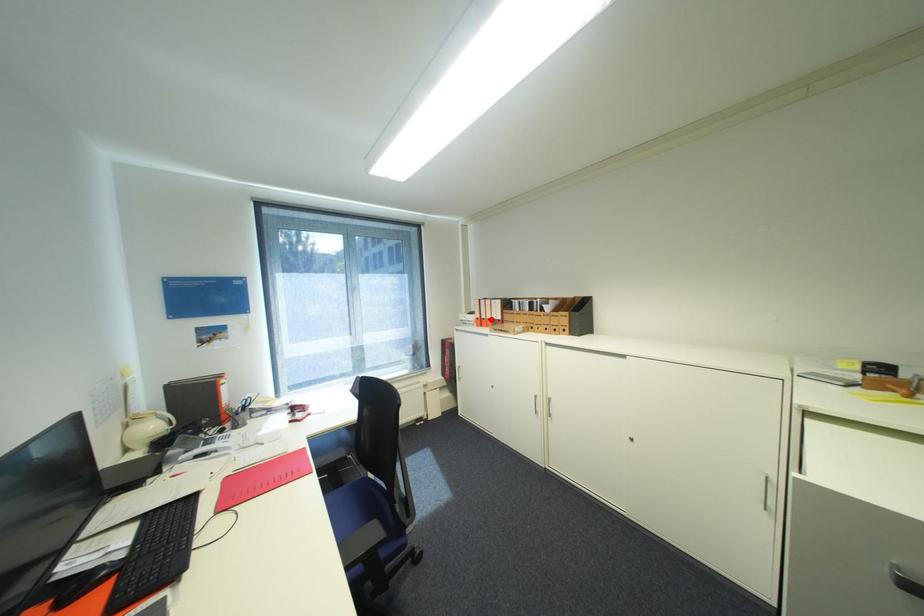
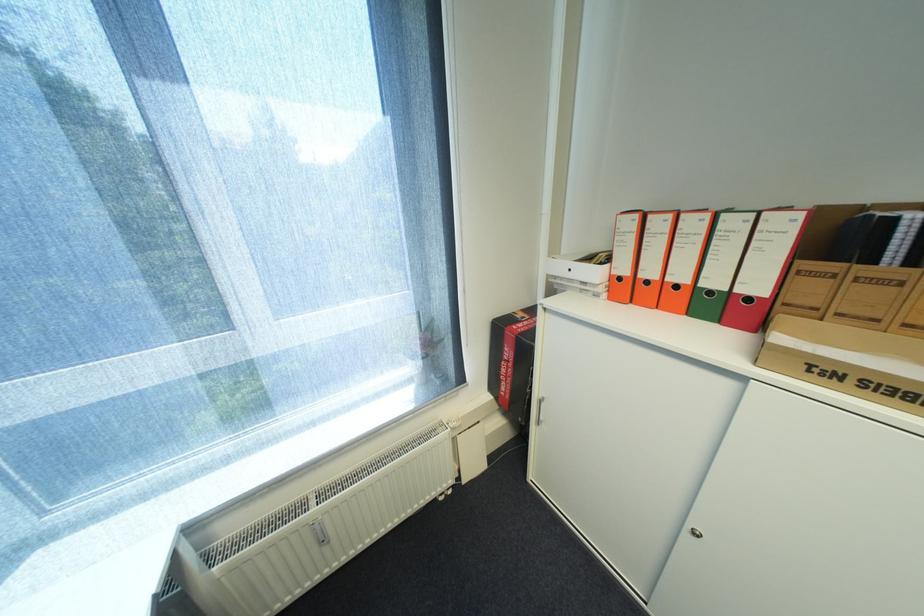
The point at the highlighted location is marked in the first image. Where is the corresponding point in the second image?

(655, 283)